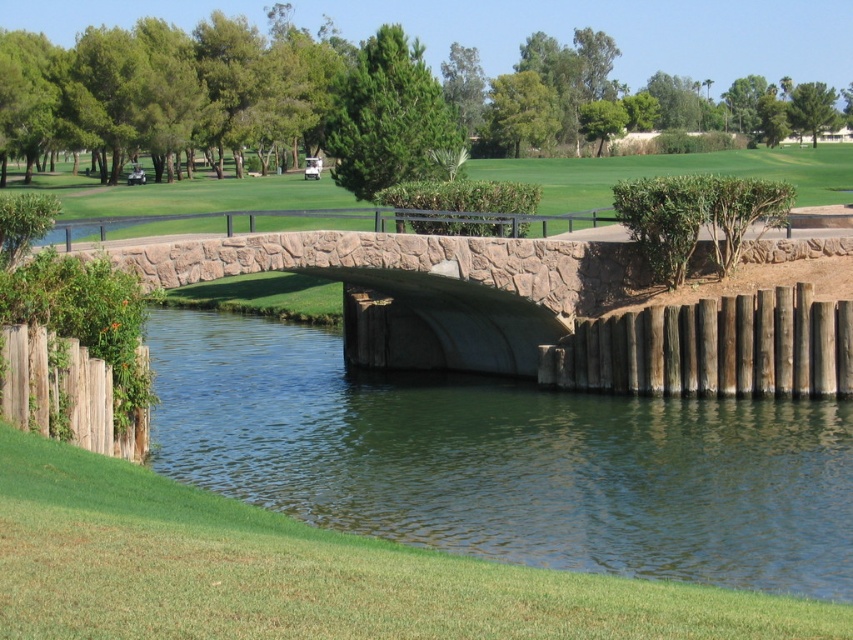
Question: Does green concrete river at center have a lesser width compared to stone bridge at center?

Choices:
 (A) no
 (B) yes

Answer: (A)

Question: Does stone bridge at center appear under smooth stone bridge at center?

Choices:
 (A) yes
 (B) no

Answer: (A)

Question: Which point is closer to the camera?

Choices:
 (A) smooth stone bridge at center
 (B) green concrete river at center
 (C) stone bridge at center

Answer: (B)

Question: Is green concrete river at center wider than smooth stone bridge at center?

Choices:
 (A) no
 (B) yes

Answer: (A)

Question: Which point appears farthest from the camera in this image?

Choices:
 (A) (631, 336)
 (B) (271, 200)

Answer: (B)

Question: Which point is farther to the camera?

Choices:
 (A) stone bridge at center
 (B) green concrete river at center
 (C) smooth stone bridge at center

Answer: (C)